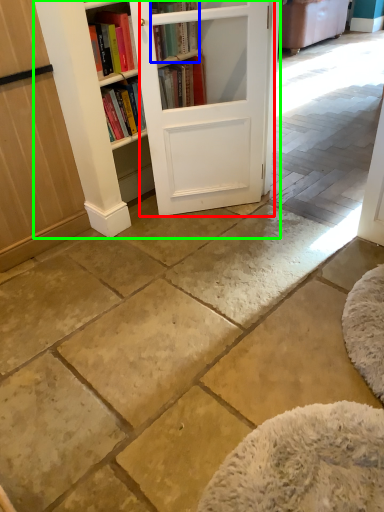
Question: Which object is positioned closest to barn door (highlighted by a red box)? Select from book (highlighted by a blue box) and bookcase (highlighted by a green box).

Choices:
 (A) book
 (B) bookcase

Answer: (A)